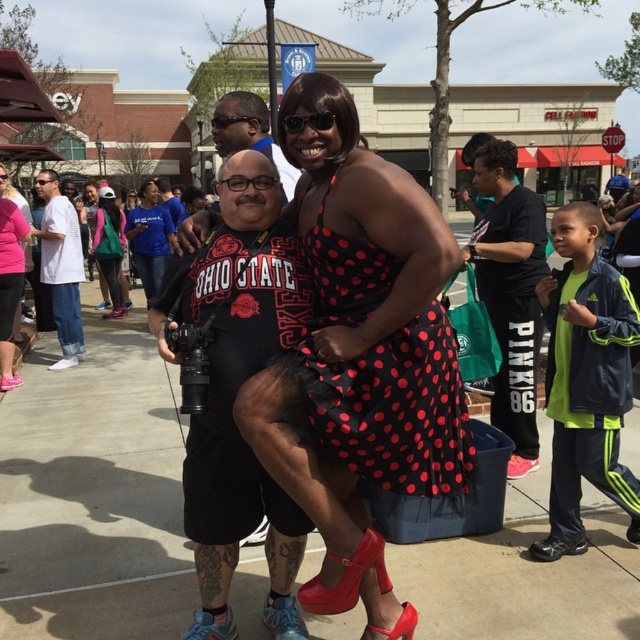
Question: From the image, what is the correct spatial relationship of white cotton shirt at left in relation to white fabric shoe at lower left?

Choices:
 (A) below
 (B) above

Answer: (B)

Question: Does pink matte dress at center appear over shiny blue sneaker at lower left?

Choices:
 (A) no
 (B) yes

Answer: (B)

Question: Considering the real-world distances, which object is closest to the green fabric jacket at center?

Choices:
 (A) pink matte dress at center
 (B) shiny red high-heeled shoe at center
 (C) blue t-shirt at center

Answer: (C)

Question: Which object is the farthest from the shiny black shoe at center?

Choices:
 (A) matte black camera at center
 (B) brushed metal shoe at center

Answer: (B)

Question: Which of the following is the closest to the observer?

Choices:
 (A) shiny blue sneaker at lower left
 (B) matte black t-shirt at center
 (C) brushed metal shoe at center

Answer: (A)

Question: Does matte black t-shirt at center appear over white fabric shoe at lower left?

Choices:
 (A) yes
 (B) no

Answer: (A)